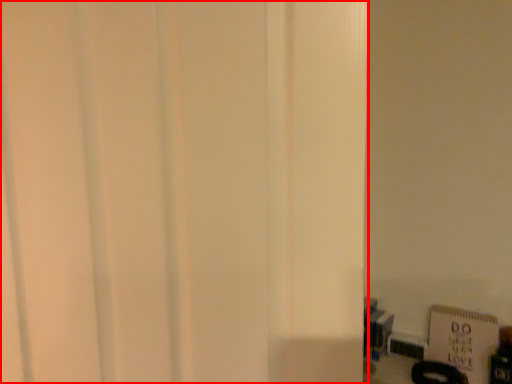
Question: From the image's perspective, where is door (annotated by the red box) located in relation to bulletin board in the image?

Choices:
 (A) below
 (B) above

Answer: (B)